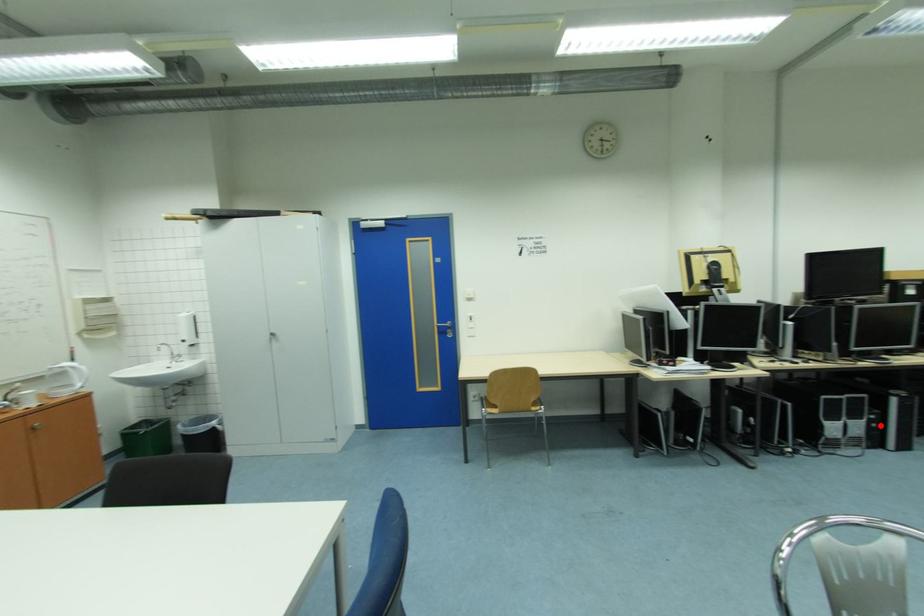
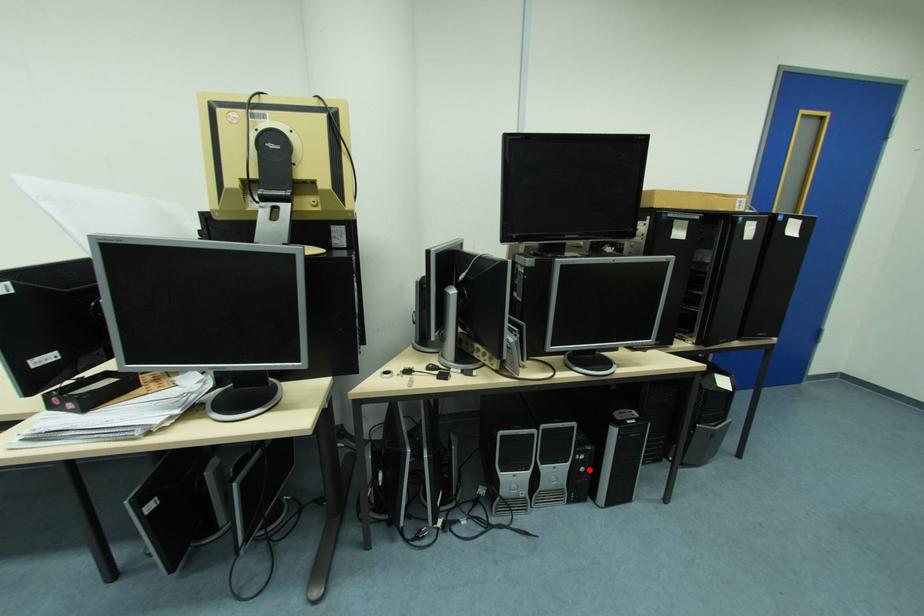
I am providing you with two images of the same scene from different viewpoints. A red point is marked on the first image and another point is marked on the second image. Is the marked point in image1 the same physical position as the marked point in image2?

Yes